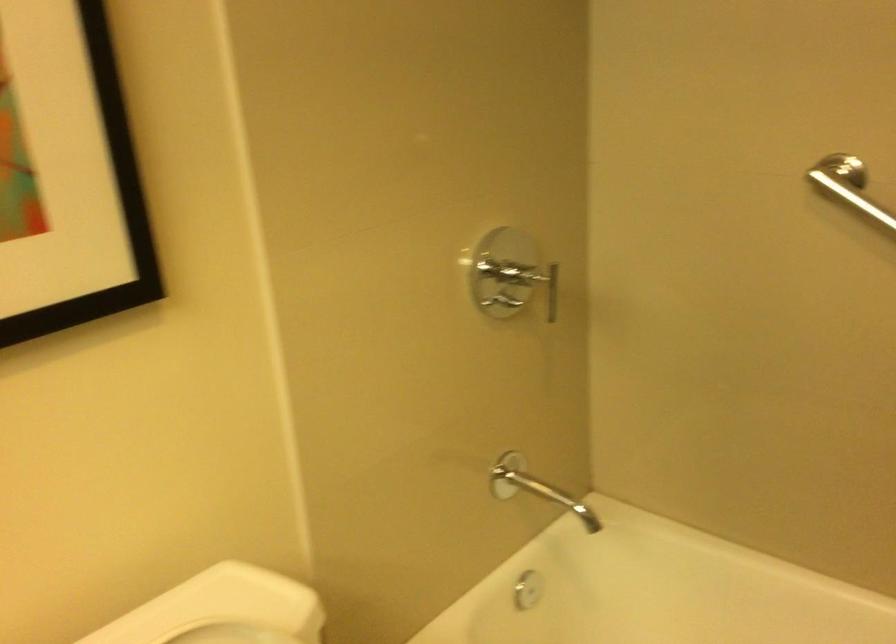
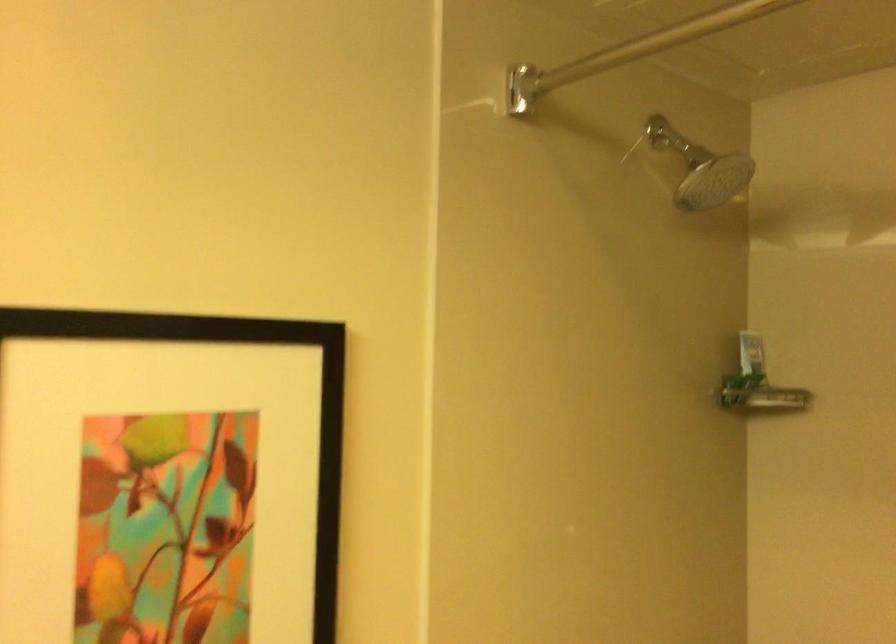
Question: Based on the continuous images, in which direction is the camera rotating? Reply with the corresponding letter.

Choices:
 (A) Left
 (B) Right
 (C) Up
 (D) Down

Answer: (C)